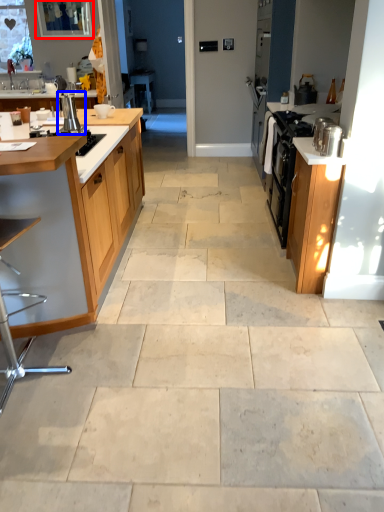
Question: Which point is closer to the camera, window screen (highlighted by a red box) or appliance (highlighted by a blue box)?

Choices:
 (A) window screen
 (B) appliance

Answer: (B)